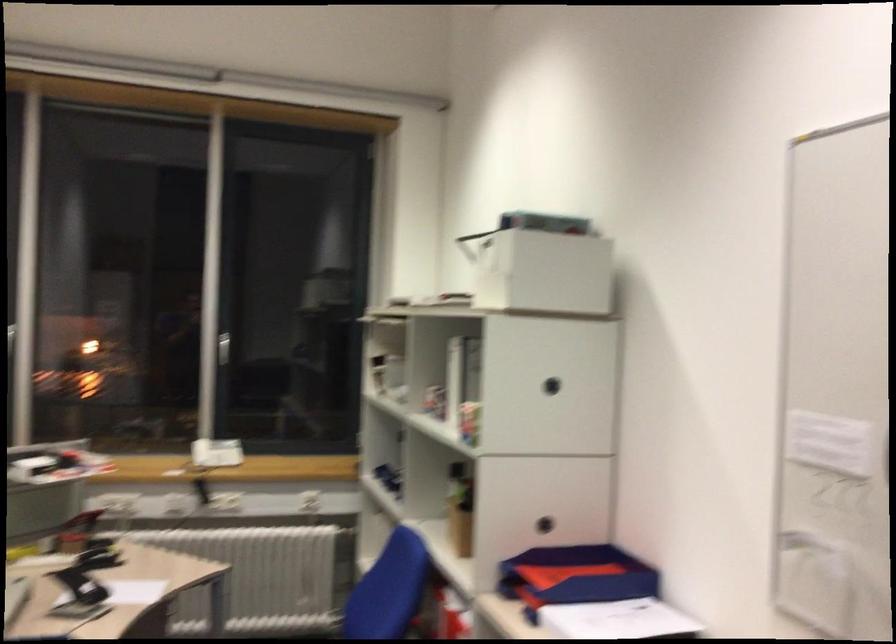
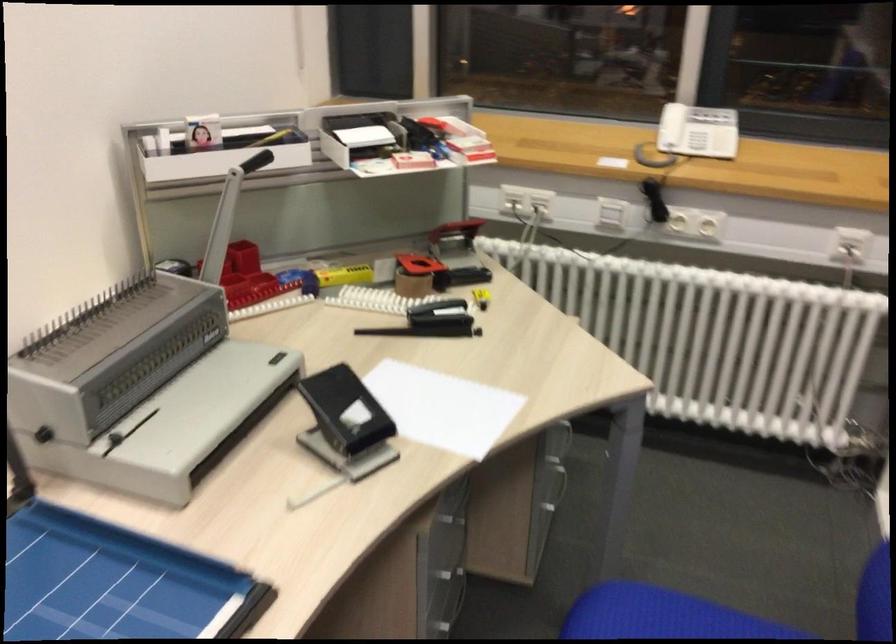
Where in the second image is the point corresponding to point 213,456 from the first image?

(686, 144)